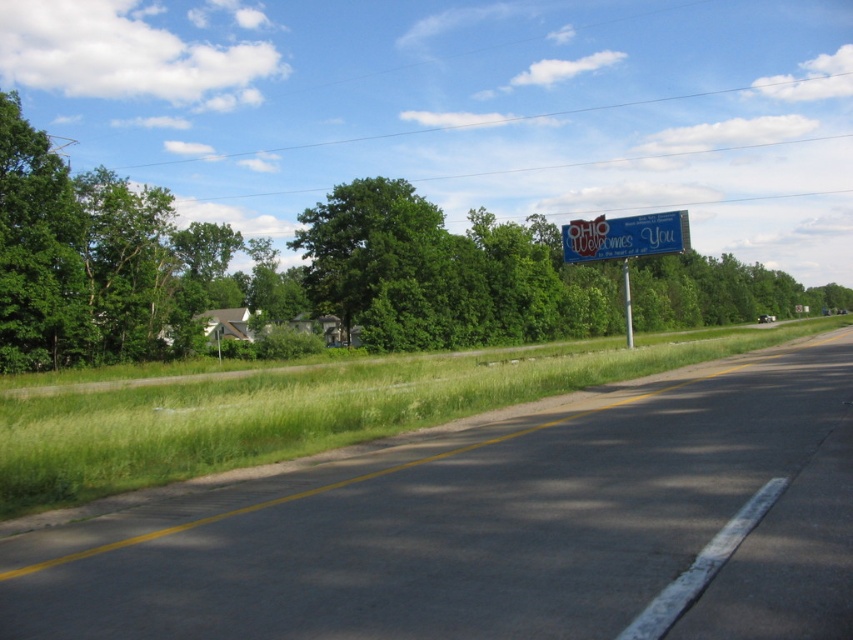
You are a photographer trying to capture the entire blue plastic billboard at upper right in your shot. However, there is a green leafy tree at upper center in the way. Based on their widths, will the tree block the billboard completely?

The green leafy tree at upper center might be wider than blue plastic billboard at upper right, so there is a possibility that the tree could partially or fully block the billboard depending on their exact positions and angles. To ensure the billboard is fully visible, you may need to adjust your camera angle or position to avoid the tree.

You are a driver approaching the road and see the green leafy tree at upper center and the blue plastic billboard at upper right. Which object is closer to the left side of the road?

The green leafy tree at upper center is closer to the left side of the road because it is positioned on the left side of the blue plastic billboard at upper right.

You are driving a car and see the asphalt road at center and the metallic pole at right. Which object is located to the left of the other?

The asphalt road at center is to the left of the metallic pole at right.